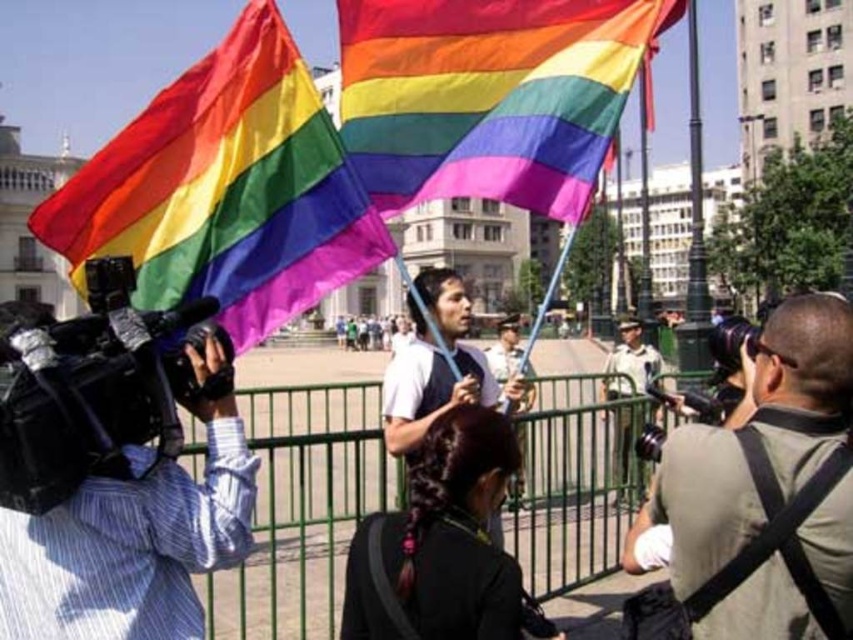
Does rainbow fabric flag at center come in front of black plastic video camera at center?

Yes.

Is rainbow fabric flag at center to the right of black plastic video camera at center from the viewer's perspective?

In fact, rainbow fabric flag at center is to the left of black plastic video camera at center.

The height and width of the screenshot is (640, 853). What do you see at coordinates (488, 96) in the screenshot? I see `rainbow fabric flag at center` at bounding box center [488, 96].

Locate an element on the screen. rainbow fabric flag at center is located at coordinates (488, 96).

Is point (172, 349) positioned before point (643, 424)?

Yes, point (172, 349) is closer to viewer.

Between black plastic video camera at left and black plastic video camera at center, which one has less height?

With less height is black plastic video camera at center.

You are a GUI agent. You are given a task and a screenshot of the screen. Output one action in this format:
    pyautogui.click(x=<x>, y=<y>)
    Task: Click on the black plastic video camera at left
    
    Given the screenshot: What is the action you would take?
    pyautogui.click(x=93, y=387)

At what (x,y) coordinates should I click in order to perform the action: click on black plastic video camera at left. Please return your answer as a coordinate pair (x, y). The width and height of the screenshot is (853, 640). Looking at the image, I should click on (93, 387).

Consider the image. Does rainbow fabric flag at upper left appear under green metal fence at center?

No, rainbow fabric flag at upper left is not below green metal fence at center.

Which is above, rainbow fabric flag at upper left or green metal fence at center?

Positioned higher is rainbow fabric flag at upper left.

Locate an element on the screen. rainbow fabric flag at upper left is located at coordinates (225, 189).